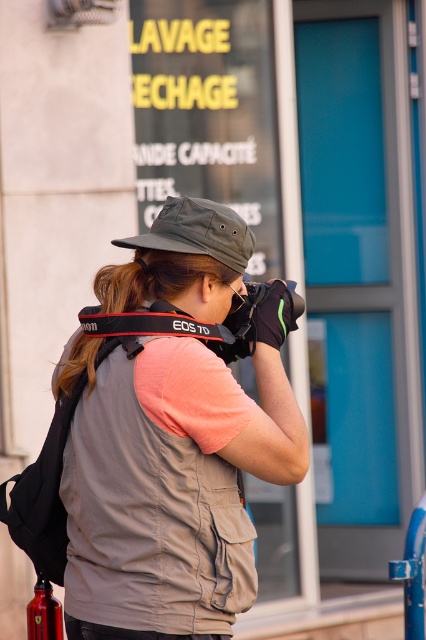
Can you confirm if matte gray vest at center is taller than brown hair at center?

Yes.

Is point (213, 509) positioned before point (106, 298)?

That is True.

Identify the location of matte gray vest at center. This screenshot has width=426, height=640. (172, 435).

Between green matte hat at center and brown hair at center, which one is positioned higher?

green matte hat at center is above.

You are a GUI agent. You are given a task and a screenshot of the screen. Output one action in this format:
    pyautogui.click(x=<x>, y=<y>)
    Task: Click on the green matte hat at center
    This screenshot has width=426, height=640.
    Given the screenshot: What is the action you would take?
    pyautogui.click(x=198, y=230)

Between green matte hat at center and red fabric camera strap at center, which one appears on the right side from the viewer's perspective?

green matte hat at center

Is point (210, 212) closer to camera compared to point (154, 320)?

No.

What do you see at coordinates (198, 230) in the screenshot? I see `green matte hat at center` at bounding box center [198, 230].

This screenshot has height=640, width=426. Identify the location of green matte hat at center. (198, 230).